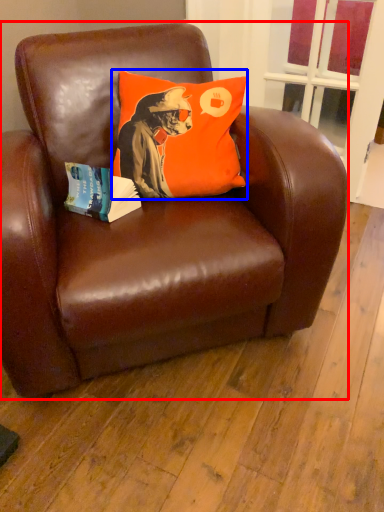
Question: Among these objects, which one is farthest to the camera, chair (highlighted by a red box) or pillow (highlighted by a blue box)?

Choices:
 (A) chair
 (B) pillow

Answer: (B)